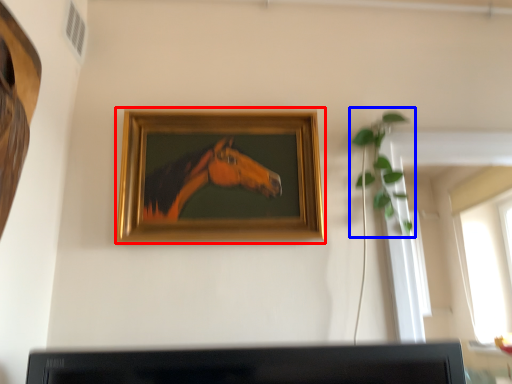
Question: Which of the following is the closest to the observer, picture frame (highlighted by a red box) or plant (highlighted by a blue box)?

Choices:
 (A) picture frame
 (B) plant

Answer: (A)